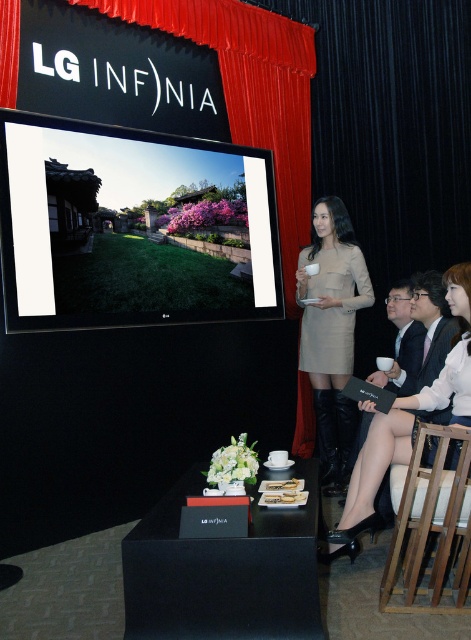
You are attending the LG Infinia promotional event and notice the red velvet curtain at upper center and the wooden at right. Which object is positioned higher in the scene?

The red velvet curtain at upper center is positioned higher than the wooden at right.

You are at the LG Infinia promotional event and want to locate the point at coordinates (132, 227) on the screen. Where exactly is this point located in relation to the screen?

The point at coordinates (132, 227) is on the matte black screen at upper left.

You are attending the LG Infinia event and notice the matte black screen at upper left and the light beige dress at center. Which object is larger in size?

The matte black screen at upper left is bigger than the light beige dress at center.